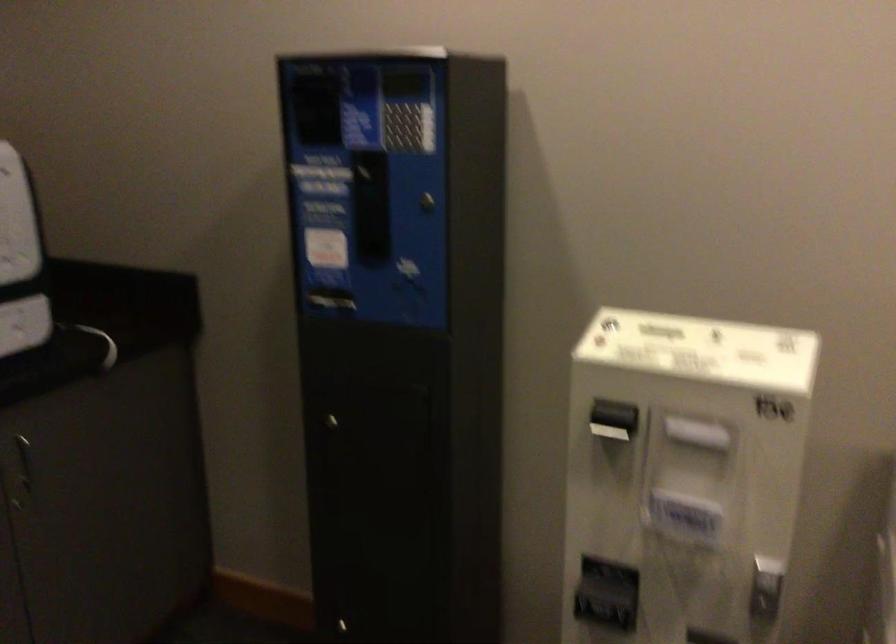
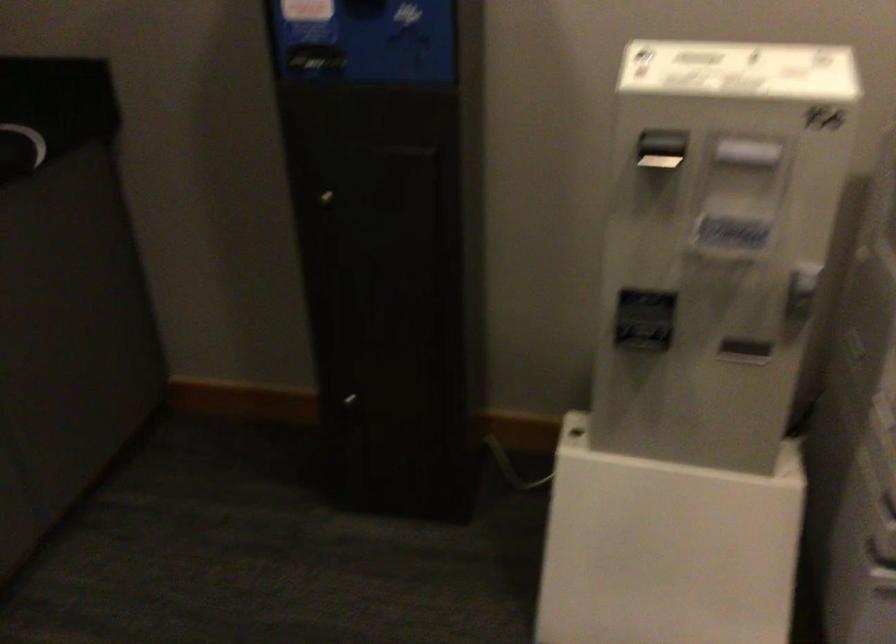
Question: In a continuous first-person perspective shot, in which direction is the camera moving?

Choices:
 (A) Left
 (B) Right
 (C) Forward
 (D) Backward

Answer: (A)